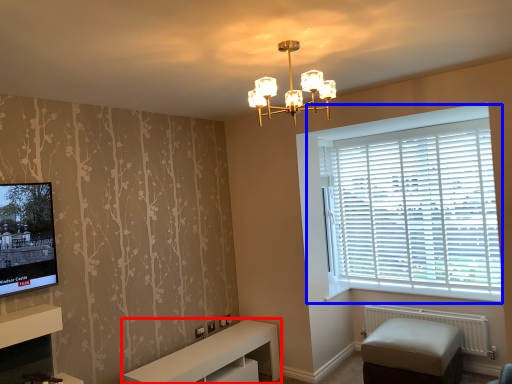
Question: Which object is closer to the camera taking this photo, furniture (highlighted by a red box) or window (highlighted by a blue box)?

Choices:
 (A) furniture
 (B) window

Answer: (A)